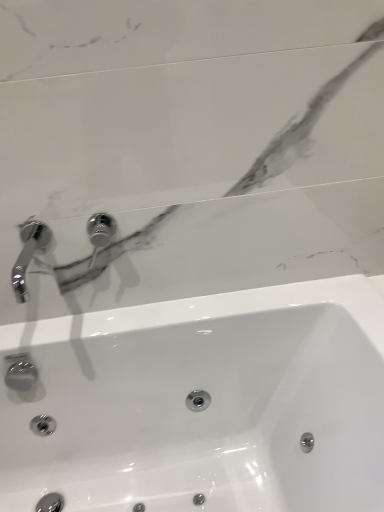
Question: Is polished chrome tap at upper center, the first tap from the right, shorter than white glossy sink at center?

Choices:
 (A) yes
 (B) no

Answer: (A)

Question: Is polished chrome tap at upper center, the first tap from the right, placed right next to white glossy sink at center?

Choices:
 (A) no
 (B) yes

Answer: (A)

Question: Can you confirm if polished chrome tap at upper center, the first tap from the right, is positioned to the right of white glossy sink at center?

Choices:
 (A) no
 (B) yes

Answer: (A)

Question: Is polished chrome tap at upper center, positioned as the second tap in left-to-right order, further to the viewer compared to white glossy sink at center?

Choices:
 (A) no
 (B) yes

Answer: (B)

Question: Considering the relative sizes of polished chrome tap at upper center, the first tap from the right, and white glossy sink at center in the image provided, is polished chrome tap at upper center, the first tap from the right, taller than white glossy sink at center?

Choices:
 (A) no
 (B) yes

Answer: (A)

Question: Is polished chrome tap at upper center, the first tap from the right, bigger than white glossy sink at center?

Choices:
 (A) yes
 (B) no

Answer: (B)

Question: Can you confirm if chrome metallic faucet at upper left, marked as the second tap in a right-to-left arrangement, is wider than polished chrome tap at upper center, positioned as the second tap in left-to-right order?

Choices:
 (A) no
 (B) yes

Answer: (B)

Question: Is chrome metallic faucet at upper left, the first tap viewed from the left, positioned with its back to polished chrome tap at upper center, positioned as the second tap in left-to-right order?

Choices:
 (A) no
 (B) yes

Answer: (A)

Question: Is chrome metallic faucet at upper left, marked as the second tap in a right-to-left arrangement, positioned in front of polished chrome tap at upper center, the first tap from the right?

Choices:
 (A) no
 (B) yes

Answer: (B)

Question: Is chrome metallic faucet at upper left, the first tap viewed from the left, facing towards polished chrome tap at upper center, positioned as the second tap in left-to-right order?

Choices:
 (A) no
 (B) yes

Answer: (A)

Question: Is chrome metallic faucet at upper left, the first tap viewed from the left, further to camera compared to polished chrome tap at upper center, positioned as the second tap in left-to-right order?

Choices:
 (A) no
 (B) yes

Answer: (A)

Question: Is polished chrome tap at upper center, positioned as the second tap in left-to-right order, a part of chrome metallic faucet at upper left, the first tap viewed from the left?

Choices:
 (A) yes
 (B) no

Answer: (B)

Question: Can you confirm if chrome metallic faucet at upper left, the first tap viewed from the left, is thinner than white glossy sink at center?

Choices:
 (A) no
 (B) yes

Answer: (B)